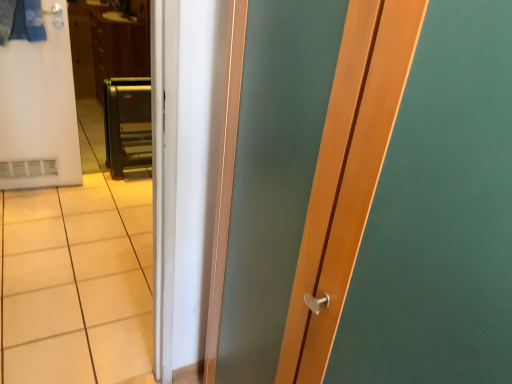
Question: Is white matte refrigerator at left surrounding brown wood dresser at upper left?

Choices:
 (A) no
 (B) yes

Answer: (A)

Question: Is white matte refrigerator at left outside of brown wood dresser at upper left?

Choices:
 (A) yes
 (B) no

Answer: (A)

Question: Is white matte refrigerator at left at the right side of brown wood dresser at upper left?

Choices:
 (A) yes
 (B) no

Answer: (B)

Question: From the image's perspective, is white matte refrigerator at left over brown wood dresser at upper left?

Choices:
 (A) no
 (B) yes

Answer: (A)

Question: Does white matte refrigerator at left have a lesser width compared to brown wood dresser at upper left?

Choices:
 (A) no
 (B) yes

Answer: (B)

Question: Considering the relative positions of white matte refrigerator at left and brown wood dresser at upper left in the image provided, is white matte refrigerator at left to the left of brown wood dresser at upper left from the viewer's perspective?

Choices:
 (A) yes
 (B) no

Answer: (A)

Question: Does metallic gray step ladder at center have a larger size compared to brown wood dresser at upper left?

Choices:
 (A) no
 (B) yes

Answer: (A)

Question: From a real-world perspective, does metallic gray step ladder at center stand above brown wood dresser at upper left?

Choices:
 (A) no
 (B) yes

Answer: (A)

Question: Can we say metallic gray step ladder at center lies outside brown wood dresser at upper left?

Choices:
 (A) yes
 (B) no

Answer: (A)

Question: Does metallic gray step ladder at center have a lesser height compared to brown wood dresser at upper left?

Choices:
 (A) yes
 (B) no

Answer: (A)

Question: Is metallic gray step ladder at center oriented towards brown wood dresser at upper left?

Choices:
 (A) yes
 (B) no

Answer: (B)

Question: Is metallic gray step ladder at center facing away from brown wood dresser at upper left?

Choices:
 (A) yes
 (B) no

Answer: (A)

Question: Can you confirm if brown wood dresser at upper left is thinner than white matte refrigerator at left?

Choices:
 (A) yes
 (B) no

Answer: (B)